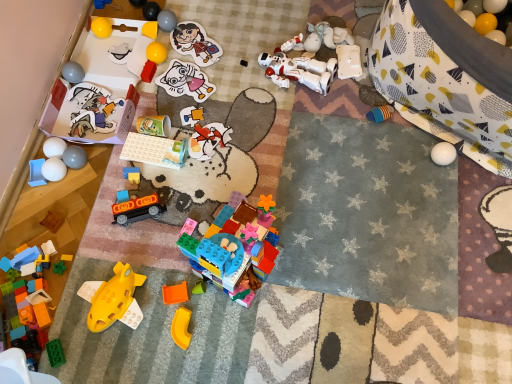
I want to click on free space to the back side of matte paper sticker at upper center, the sixth toy from the right, so click(202, 14).